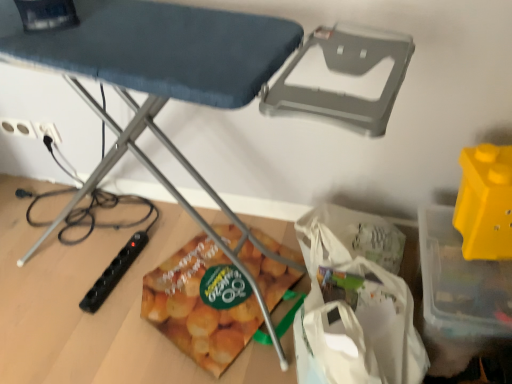
You are a GUI agent. You are given a task and a screenshot of the screen. Output one action in this format:
    pyautogui.click(x=<x>, y=<y>)
    Task: Click on the free area in between matte plastic snack bag at lower center and metallic ironing board at center
    
    Given the screenshot: What is the action you would take?
    pyautogui.click(x=141, y=218)